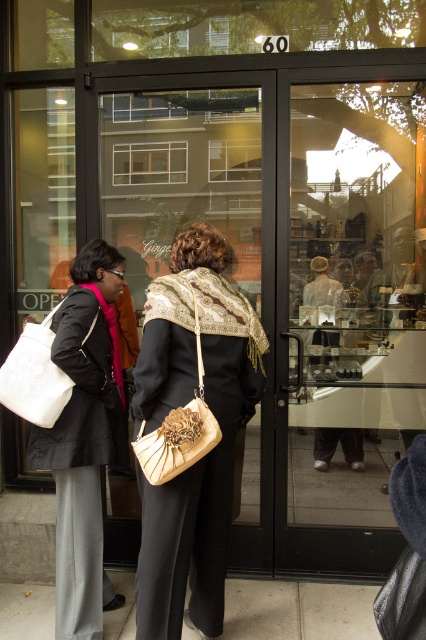
Is white woven tote at left positioned in front of gold textured purse at center?

No, it is not.

Describe the element at coordinates (34, 376) in the screenshot. The width and height of the screenshot is (426, 640). I see `white woven tote at left` at that location.

At what (x,y) coordinates should I click in order to perform the action: click on white woven tote at left. Please return your answer as a coordinate pair (x, y). Looking at the image, I should click on (34, 376).

Based on the photo, does transparent glass door at center lie in front of gold textured purse at center?

No, it is behind gold textured purse at center.

Is transparent glass door at center shorter than gold textured purse at center?

In fact, transparent glass door at center may be taller than gold textured purse at center.

Is point (408, 196) positioned after point (144, 456)?

Yes, point (408, 196) is behind point (144, 456).

Find the location of a particular element. transparent glass door at center is located at coordinates (351, 317).

Who is more forward, (28, 449) or (46, 400)?

Positioned in front is point (46, 400).

The width and height of the screenshot is (426, 640). Describe the element at coordinates (85, 436) in the screenshot. I see `matte black jacket at left` at that location.

You are a GUI agent. You are given a task and a screenshot of the screen. Output one action in this format:
    pyautogui.click(x=<x>, y=<y>)
    Task: Click on the matte black jacket at left
    This screenshot has height=640, width=426.
    Given the screenshot: What is the action you would take?
    pyautogui.click(x=85, y=436)